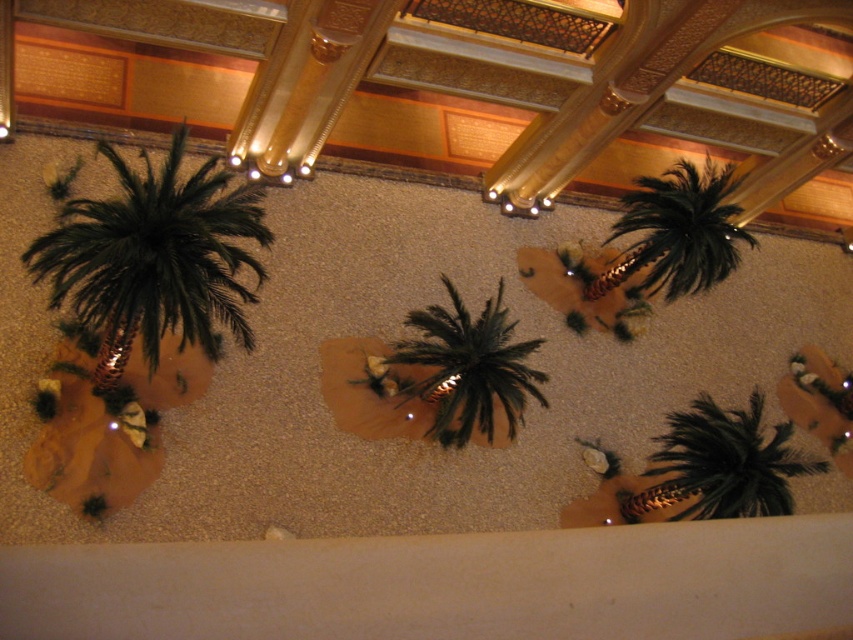
Question: Which point is farther to the camera?

Choices:
 (A) green matte palm tree at lower right
 (B) black feathered palm tree at upper right
 (C) green matte palm tree at center
 (D) green artificial palm tree at left

Answer: (B)

Question: Does green artificial palm tree at left come behind green matte palm tree at lower right?

Choices:
 (A) no
 (B) yes

Answer: (A)

Question: Based on their relative distances, which object is nearer to the black feathered palm tree at upper right?

Choices:
 (A) green matte palm tree at center
 (B) green artificial palm tree at left

Answer: (A)

Question: Is green artificial palm tree at left thinner than green matte palm tree at center?

Choices:
 (A) no
 (B) yes

Answer: (A)

Question: Which point is farther from the camera taking this photo?

Choices:
 (A) (740, 497)
 (B) (537, 396)

Answer: (B)

Question: Is green artificial palm tree at left below green matte palm tree at lower right?

Choices:
 (A) yes
 (B) no

Answer: (B)